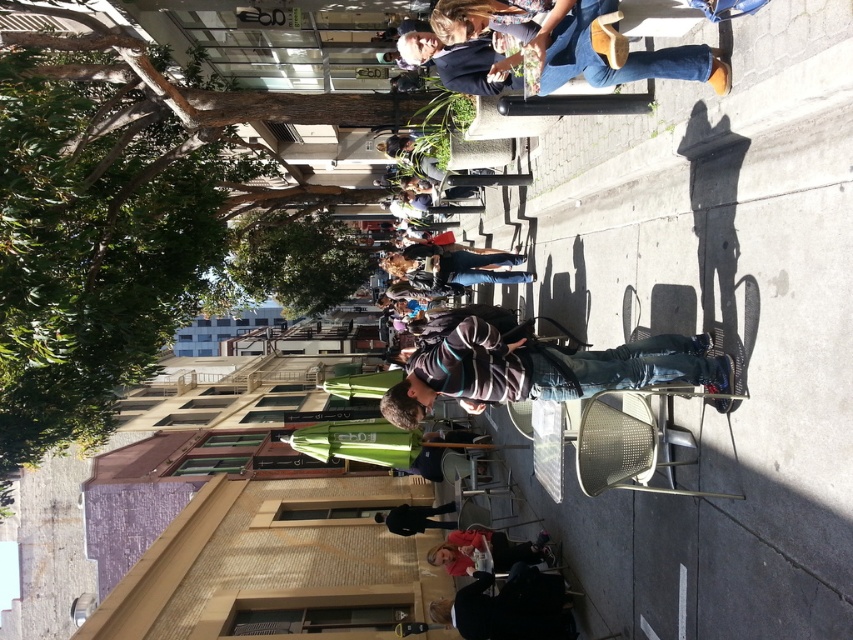
Question: Which object is farther from the camera taking this photo?

Choices:
 (A) matte pink shirt at lower center
 (B) denim jeans at upper center

Answer: (A)

Question: Estimate the real-world distances between objects in this image. Which object is farther from the black fabric jacket at lower center?

Choices:
 (A) dark gray fabric jacket at lower center
 (B) matte pink shirt at lower center
 (C) denim jeans at upper center
 (D) striped fabric shirt at center

Answer: (C)

Question: Can you confirm if striped fabric shirt at center is positioned above black fabric jacket at lower center?

Choices:
 (A) yes
 (B) no

Answer: (A)

Question: Which object appears closest to the camera in this image?

Choices:
 (A) black fabric jacket at lower center
 (B) matte pink shirt at lower center

Answer: (B)

Question: Does dark gray fabric jacket at lower center have a smaller size compared to black fabric jacket at lower center?

Choices:
 (A) yes
 (B) no

Answer: (B)

Question: Is striped fabric shirt at center smaller than matte pink shirt at lower center?

Choices:
 (A) yes
 (B) no

Answer: (A)